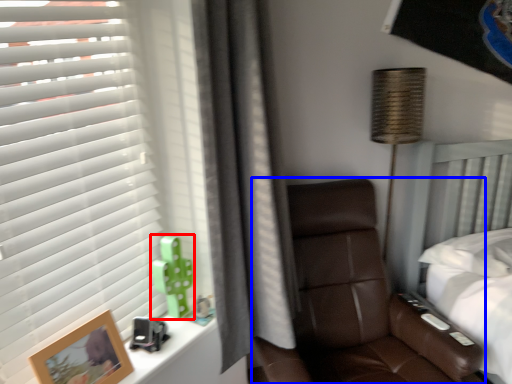
Question: Which point is closer to the camera, toy (highlighted by a red box) or chair (highlighted by a blue box)?

Choices:
 (A) toy
 (B) chair

Answer: (B)